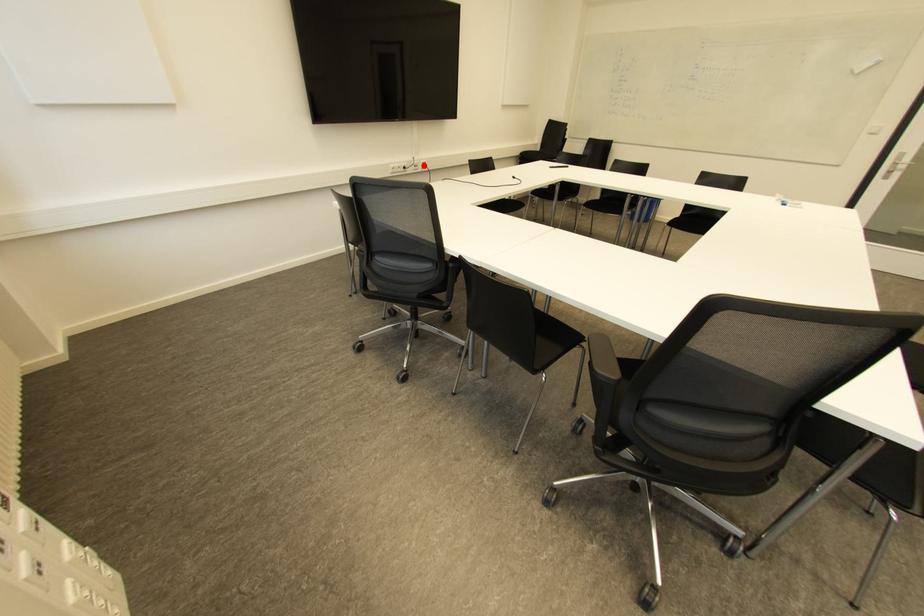
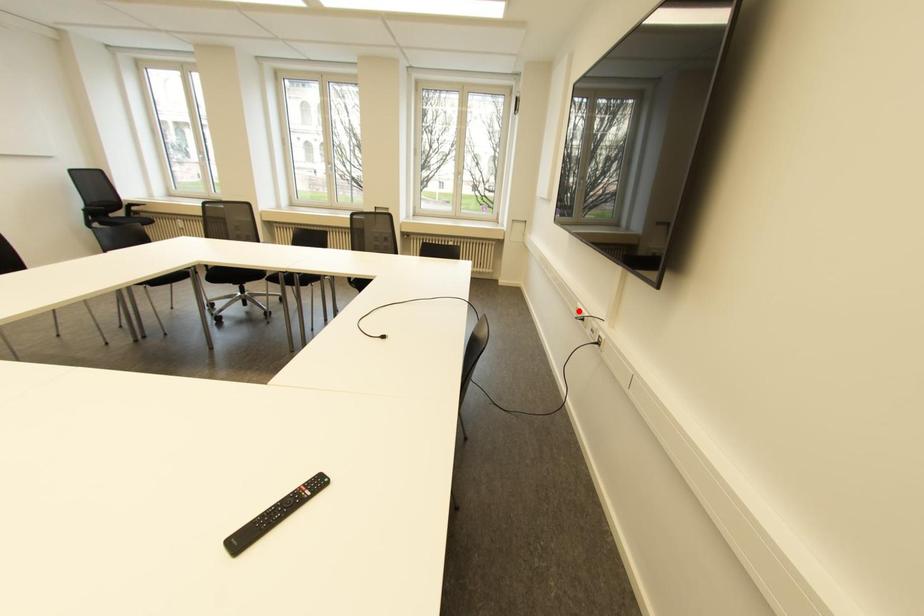
I am providing you with two images of the same scene from different viewpoints. A red point is marked on the first image and another point is marked on the second image. Is the red point in image1 aligned with the point shown in image2?

No